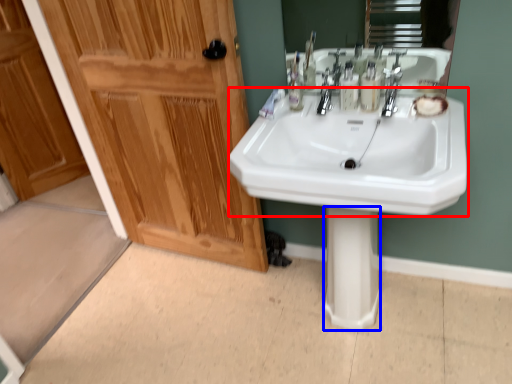
Question: Among these objects, which one is farthest to the camera, sink (highlighted by a red box) or pillar (highlighted by a blue box)?

Choices:
 (A) sink
 (B) pillar

Answer: (B)